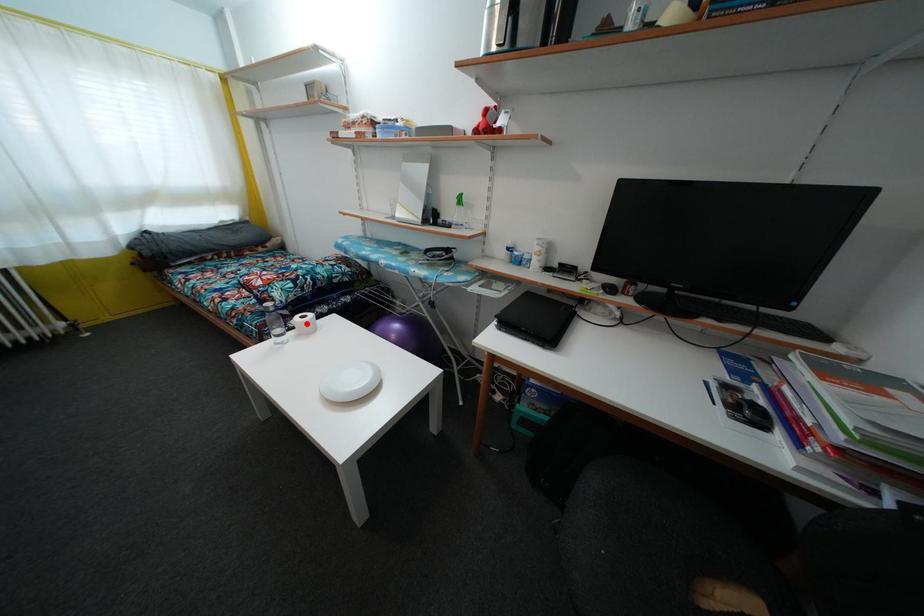
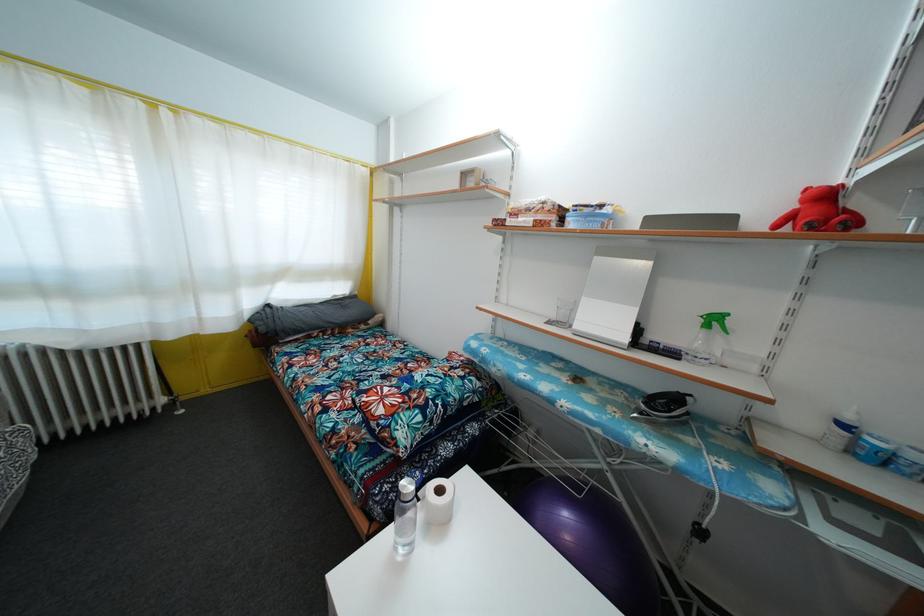
Question: I am providing you with two images of the same scene from different viewpoints. A red point is marked on the first image. At the location where the point appears in image 1, is it still visible in image 2?

Choices:
 (A) Yes
 (B) No

Answer: (A)